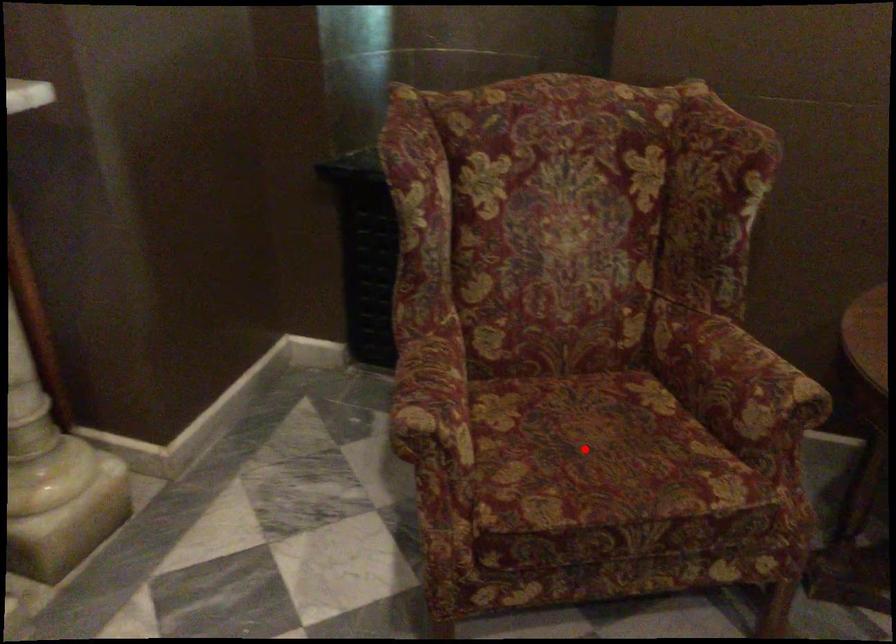
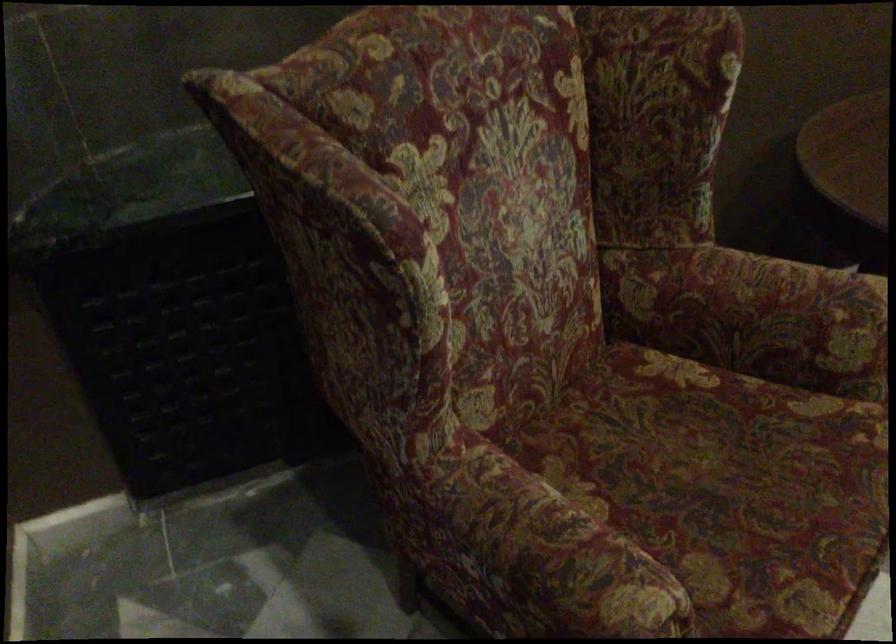
Question: I am providing you with two images of the same scene from different viewpoints. In image1, a red point is highlighted. Considering the same 3D point in image2, which of the following is correct?

Choices:
 (A) It is closer
 (B) It is farther

Answer: (A)